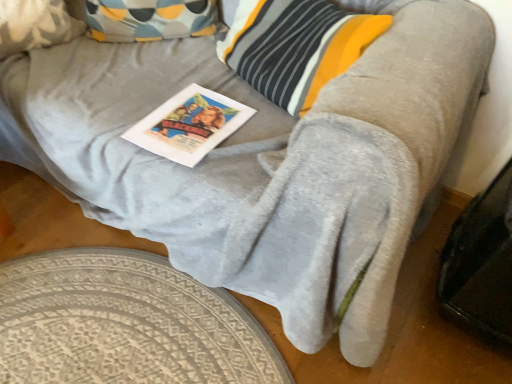
Question: From the image's perspective, is fluffy beige pillow at upper left below white paper magazine at center?

Choices:
 (A) no
 (B) yes

Answer: (A)

Question: Does fluffy beige pillow at upper left contain white paper magazine at center?

Choices:
 (A) no
 (B) yes

Answer: (A)

Question: From a real-world perspective, is fluffy beige pillow at upper left physically above white paper magazine at center?

Choices:
 (A) yes
 (B) no

Answer: (A)

Question: Considering the relative sizes of fluffy beige pillow at upper left and white paper magazine at center in the image provided, is fluffy beige pillow at upper left shorter than white paper magazine at center?

Choices:
 (A) no
 (B) yes

Answer: (A)

Question: Is the surface of fluffy beige pillow at upper left in direct contact with white paper magazine at center?

Choices:
 (A) no
 (B) yes

Answer: (A)

Question: In the image, is textured beige rug at lower left positioned in front of or behind fluffy beige pillow at upper left?

Choices:
 (A) front
 (B) behind

Answer: (A)

Question: Considering the positions of textured beige rug at lower left and fluffy beige pillow at upper left in the image, is textured beige rug at lower left taller or shorter than fluffy beige pillow at upper left?

Choices:
 (A) tall
 (B) short

Answer: (B)

Question: Considering the positions of textured beige rug at lower left and fluffy beige pillow at upper left in the image, is textured beige rug at lower left bigger or smaller than fluffy beige pillow at upper left?

Choices:
 (A) big
 (B) small

Answer: (B)

Question: Looking at their shapes, would you say textured beige rug at lower left is wider or thinner than fluffy beige pillow at upper left?

Choices:
 (A) wide
 (B) thin

Answer: (A)

Question: From a real-world perspective, relative to textured beige rug at lower left, is fluffy beige pillow at upper left vertically above or below?

Choices:
 (A) above
 (B) below

Answer: (A)

Question: Which is correct: fluffy beige pillow at upper left is inside textured beige rug at lower left, or outside of it?

Choices:
 (A) inside
 (B) outside

Answer: (B)

Question: Would you say fluffy beige pillow at upper left is to the left or to the right of textured beige rug at lower left in the picture?

Choices:
 (A) right
 (B) left

Answer: (B)

Question: In terms of height, does fluffy beige pillow at upper left look taller or shorter compared to textured beige rug at lower left?

Choices:
 (A) short
 (B) tall

Answer: (B)

Question: Is point (236, 105) positioned closer to the camera than point (60, 18)?

Choices:
 (A) closer
 (B) farther

Answer: (A)

Question: Would you say white paper magazine at center is inside or outside fluffy beige pillow at upper left?

Choices:
 (A) outside
 (B) inside

Answer: (A)